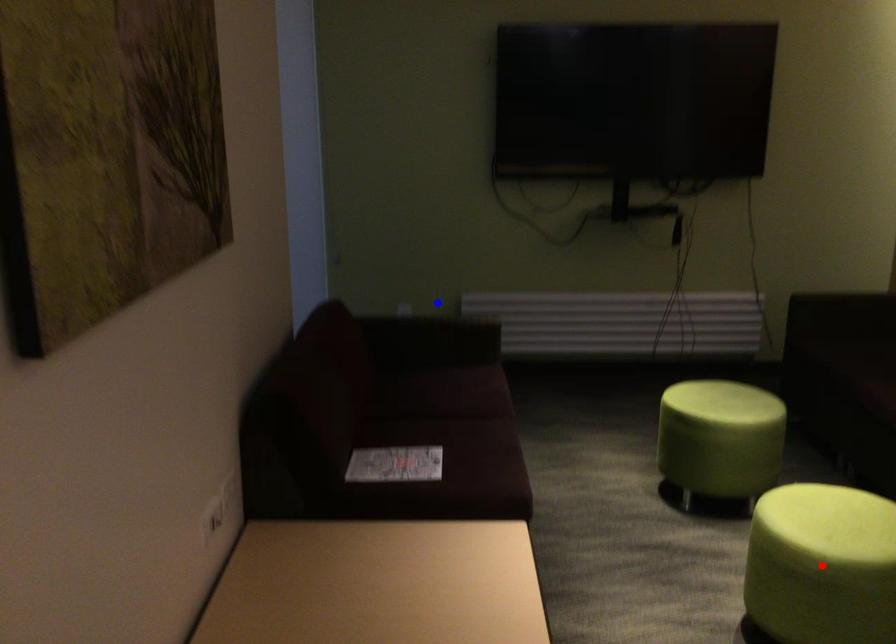
Question: Which of the two points in the image is closer to the camera?

Choices:
 (A) Blue point is closer.
 (B) Red point is closer.

Answer: (B)